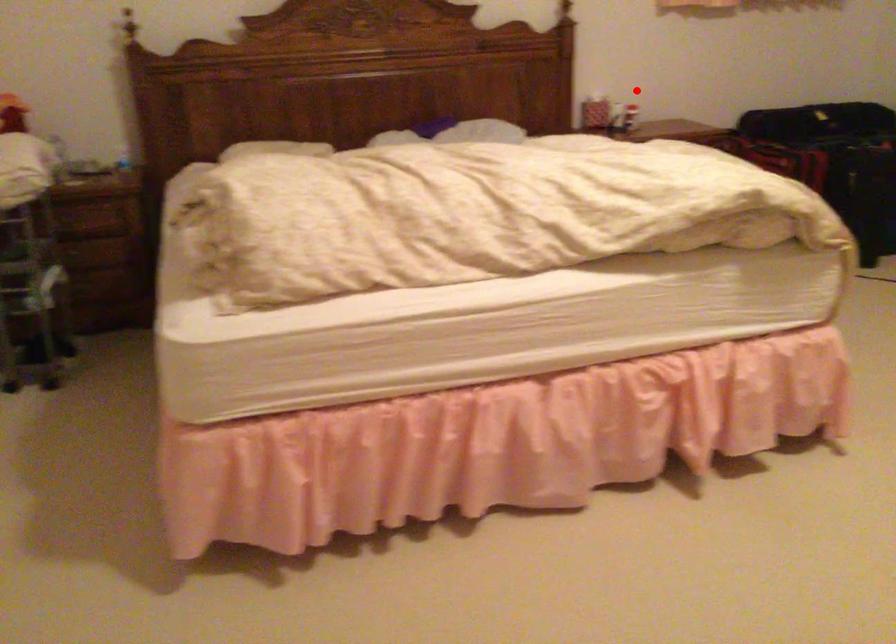
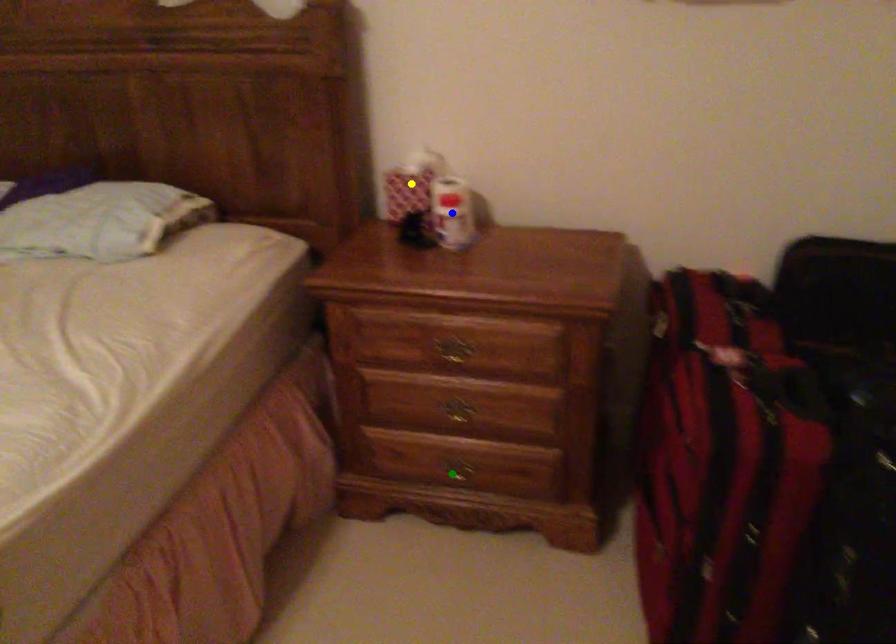
Question: I am providing you with two images of the same scene from different viewpoints. A red point is marked on the first image. You are given multiple points on the second image. Which point in image 2 represents the same 3d spot as the red point in image 1?

Choices:
 (A) yellow point
 (B) green point
 (C) blue point

Answer: (C)